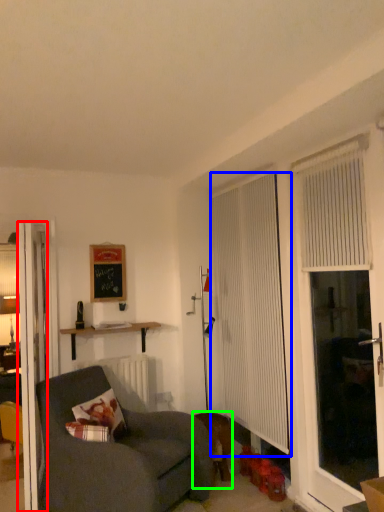
Question: Based on their relative distances, which object is nearer to door (highlighted by a red box)? Choose from curtain (highlighted by a blue box) and animal (highlighted by a green box).

Choices:
 (A) curtain
 (B) animal

Answer: (B)